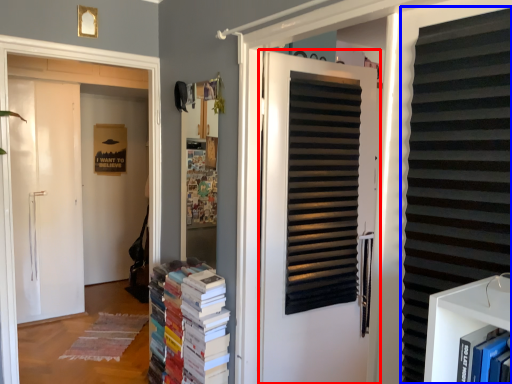
Question: Which of the following is the closest to the observer, door (highlighted by a red box) or shutter (highlighted by a blue box)?

Choices:
 (A) door
 (B) shutter

Answer: (B)